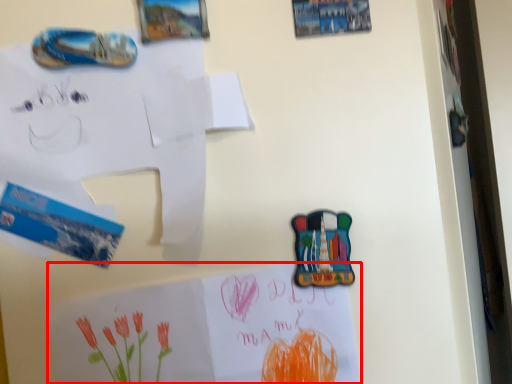
Question: From the image, what is the correct spatial relationship of paper (annotated by the red box) in relation to paper?

Choices:
 (A) right
 (B) left

Answer: (A)